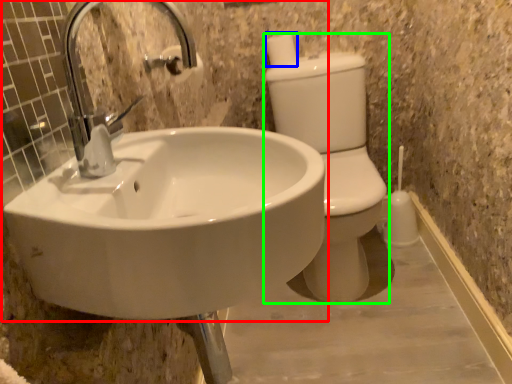
Question: Estimate the real-world distances between objects in this image. Which object is farther from sink (highlighted by a red box), toilet paper (highlighted by a blue box) or toilet bowl (highlighted by a green box)?

Choices:
 (A) toilet paper
 (B) toilet bowl

Answer: (A)